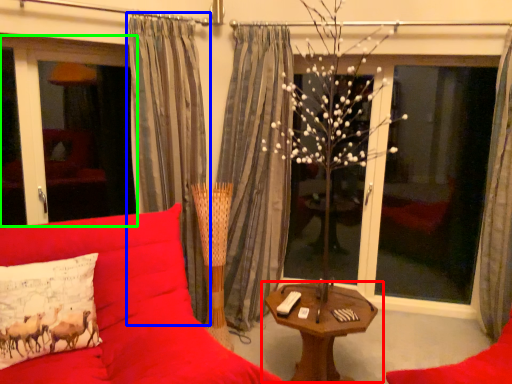
Question: Which object is positioned closest to table (highlighted by a red box)? Select from curtain (highlighted by a blue box) and window screen (highlighted by a green box).

Choices:
 (A) curtain
 (B) window screen

Answer: (A)